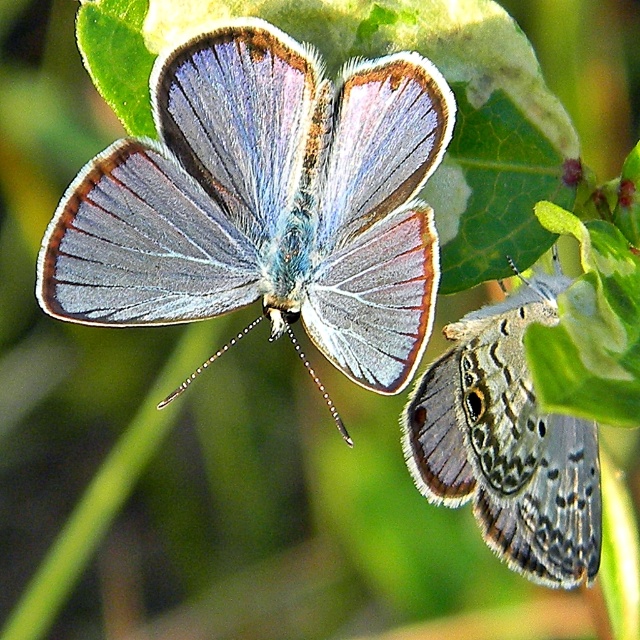
Question: Which object is closer to the camera taking this photo?

Choices:
 (A) matte blue wings at center
 (B) translucent gray wings at lower right

Answer: (A)

Question: Which point is closer to the camera taking this photo?

Choices:
 (A) (380, 243)
 (B) (554, 449)

Answer: (A)

Question: Is matte blue wings at center positioned at the back of translucent gray wings at lower right?

Choices:
 (A) yes
 (B) no

Answer: (B)

Question: Does matte blue wings at center have a greater width compared to translucent gray wings at lower right?

Choices:
 (A) no
 (B) yes

Answer: (B)

Question: Is matte blue wings at center closer to camera compared to translucent gray wings at lower right?

Choices:
 (A) yes
 (B) no

Answer: (A)